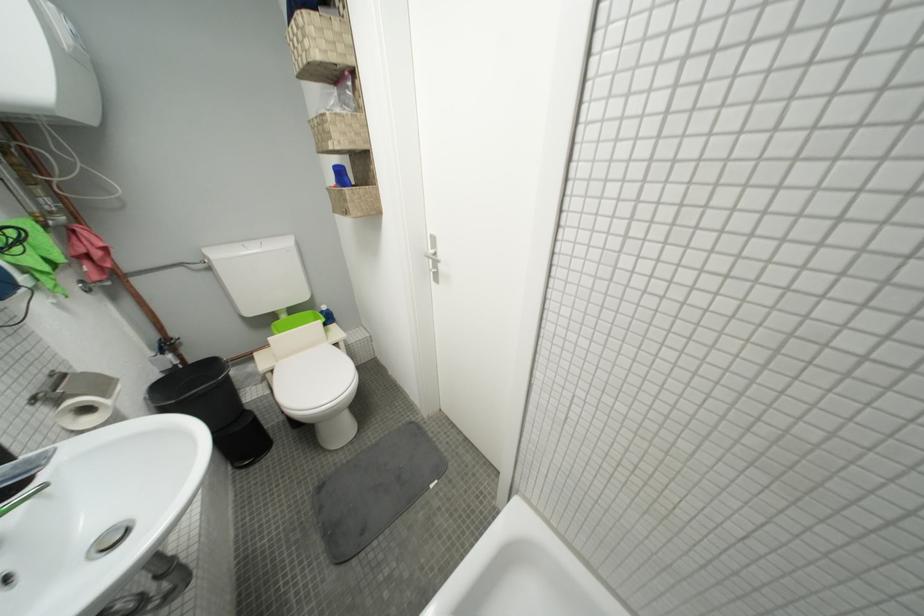
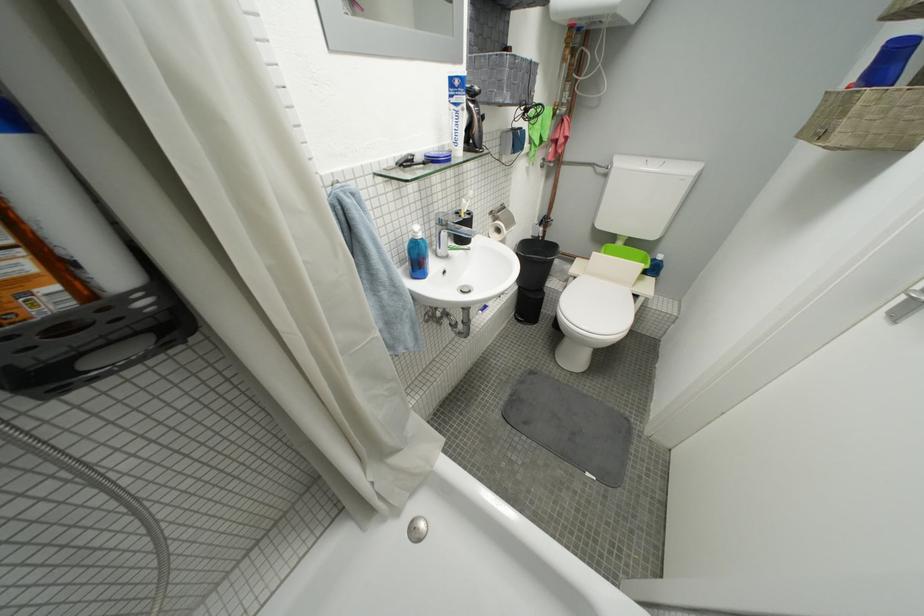
The point at [248,474] is marked in the first image. Where is the corresponding point in the second image?

(523, 322)